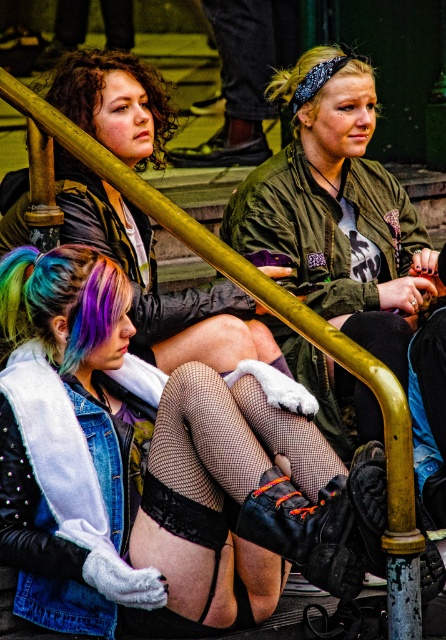
Question: Which of the following is the farthest from the observer?

Choices:
 (A) green matte bomber jacket at center
 (B) blondehair at upper center

Answer: (B)

Question: Which of the following is the closest to the observer?

Choices:
 (A) (45, 515)
 (B) (319, 397)

Answer: (A)

Question: Which is nearer to the fishnet stockings at center?

Choices:
 (A) blondehair at upper center
 (B) suede boot at lower center
 (C) green matte bomber jacket at center
 (D) denim vest at center

Answer: (B)

Question: Can you confirm if fishnet stockings at center is positioned below rainbow dyed hair at lower left?

Choices:
 (A) yes
 (B) no

Answer: (A)

Question: Is the position of green matte bomber jacket at center more distant than that of blondehair at upper center?

Choices:
 (A) no
 (B) yes

Answer: (A)

Question: Does green matte bomber jacket at center have a larger size compared to rainbow dyed hair at lower left?

Choices:
 (A) yes
 (B) no

Answer: (A)